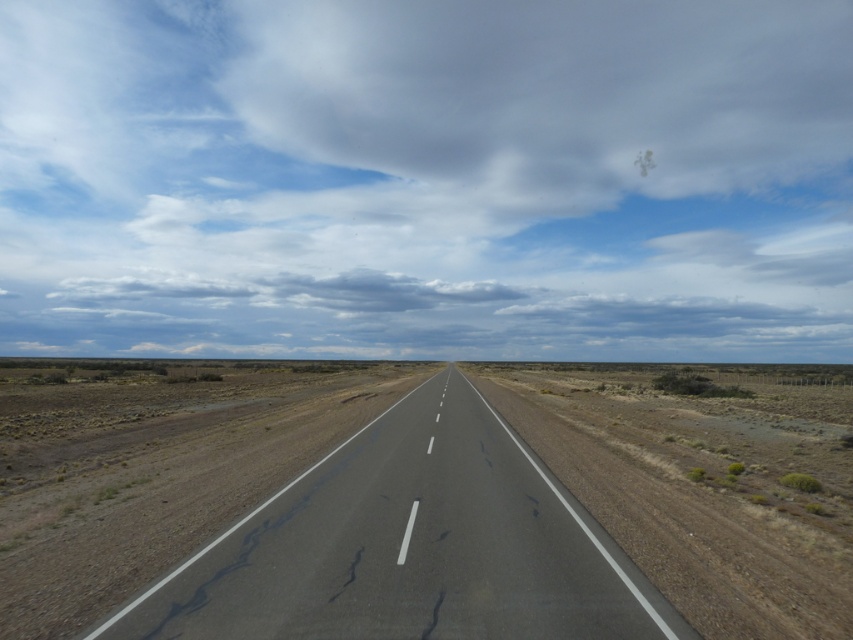
Question: Can you confirm if white fluffy cloud at upper center is positioned to the left of asphalt road at center?

Choices:
 (A) yes
 (B) no

Answer: (A)

Question: Can you confirm if white fluffy cloud at upper center is bigger than asphalt road at center?

Choices:
 (A) yes
 (B) no

Answer: (A)

Question: Does white fluffy cloud at upper center have a lesser width compared to asphalt road at center?

Choices:
 (A) yes
 (B) no

Answer: (B)

Question: Which point is closer to the camera taking this photo?

Choices:
 (A) (531, 168)
 (B) (271, 500)

Answer: (B)

Question: Which point is closer to the camera?

Choices:
 (A) (556, 579)
 (B) (508, 140)

Answer: (A)

Question: Among these points, which one is farthest from the camera?

Choices:
 (A) (381, 620)
 (B) (433, 292)

Answer: (B)